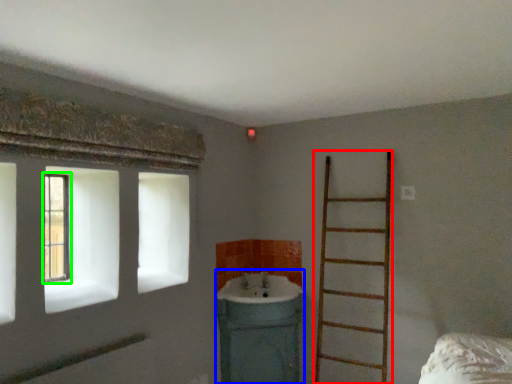
Question: Which object is the closest to the ladder (highlighted by a red box)? Choose among these: sink (highlighted by a blue box) or window (highlighted by a green box).

Choices:
 (A) sink
 (B) window

Answer: (A)